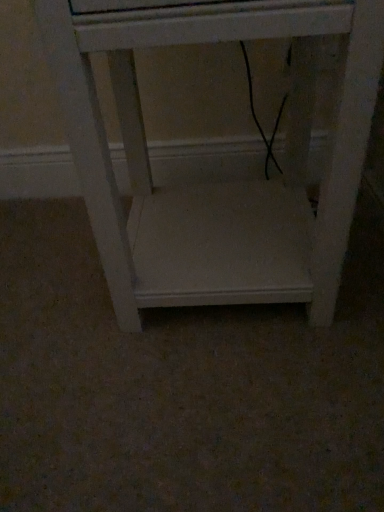
Locate an element on the screen. white matte shelf at center is located at coordinates (217, 184).

The width and height of the screenshot is (384, 512). Describe the element at coordinates (217, 184) in the screenshot. I see `white matte shelf at center` at that location.

Where is `white matte shelf at center`? white matte shelf at center is located at coordinates (217, 184).